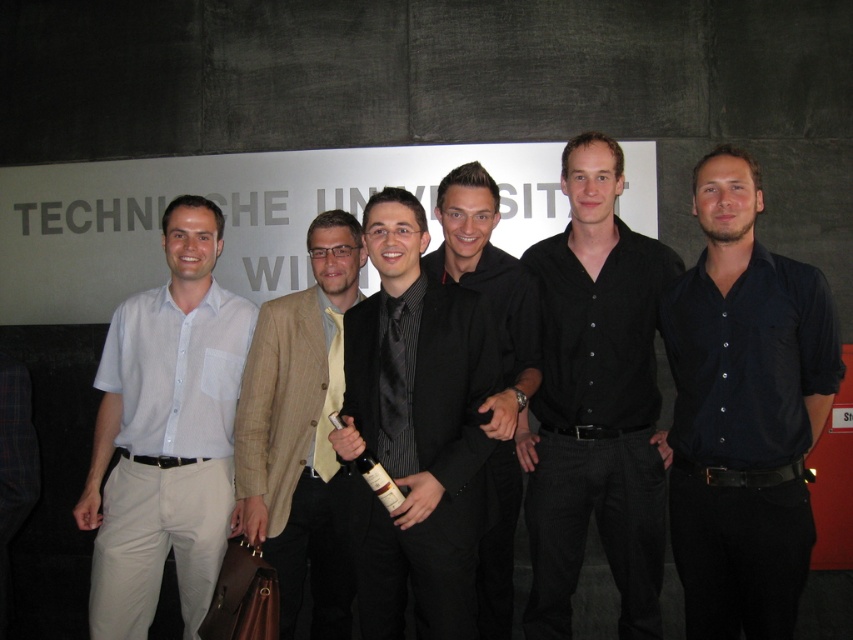
You are a photographer setting up for a group photo. You notice the black satin suit at center and the black matte shirt at right. Which one is positioned closer to the camera?

The black matte shirt at right is closer to the camera than the black satin suit at center because the black satin suit at center is behind the black matte shirt at right.